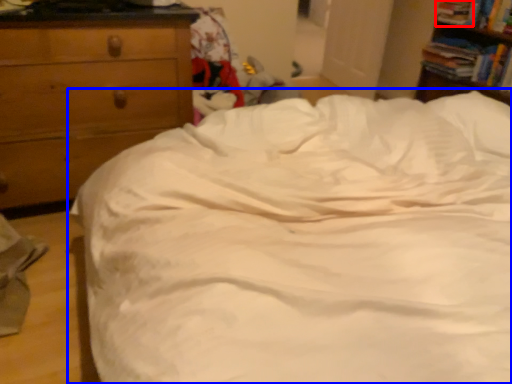
Question: Which object is further to the camera taking this photo, book (highlighted by a red box) or bed (highlighted by a blue box)?

Choices:
 (A) book
 (B) bed

Answer: (A)